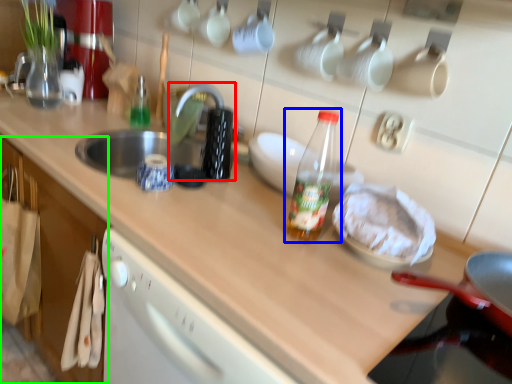
Question: Estimate the real-world distances between objects in this image. Which object is closer to faucet (highlighted by a red box), bottle (highlighted by a blue box) or cabinetry (highlighted by a green box)?

Choices:
 (A) bottle
 (B) cabinetry

Answer: (A)